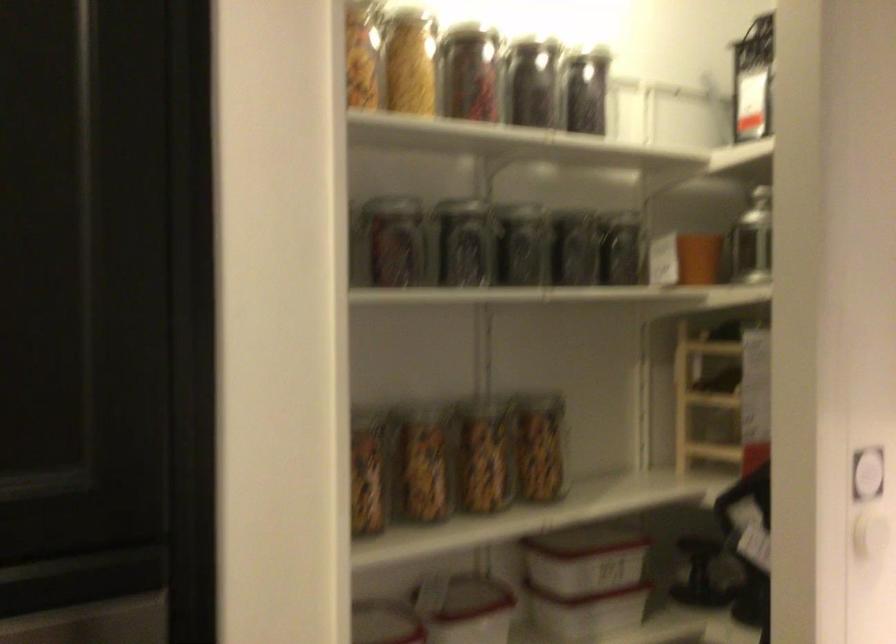
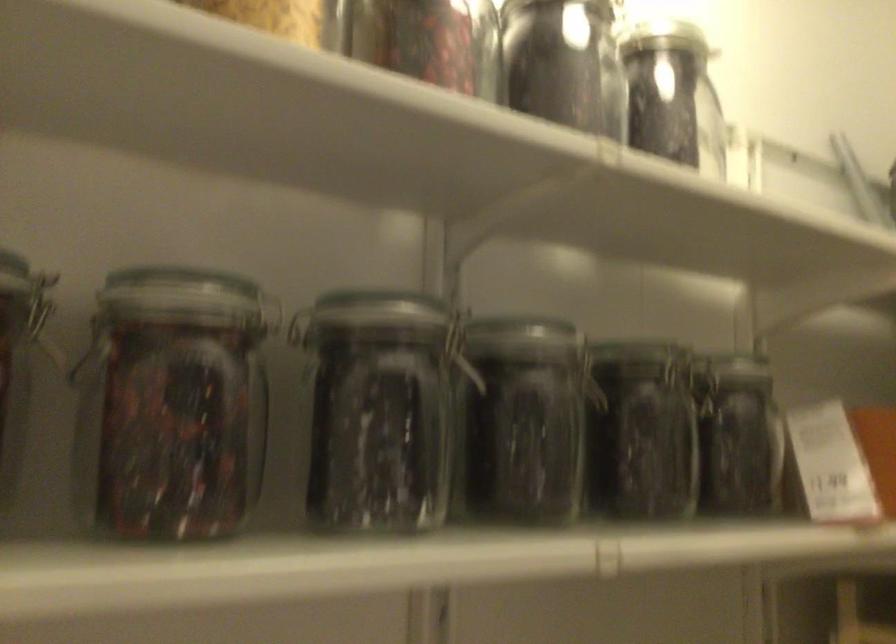
The point at (x=581, y=219) is marked in the first image. Where is the corresponding point in the second image?

(652, 361)